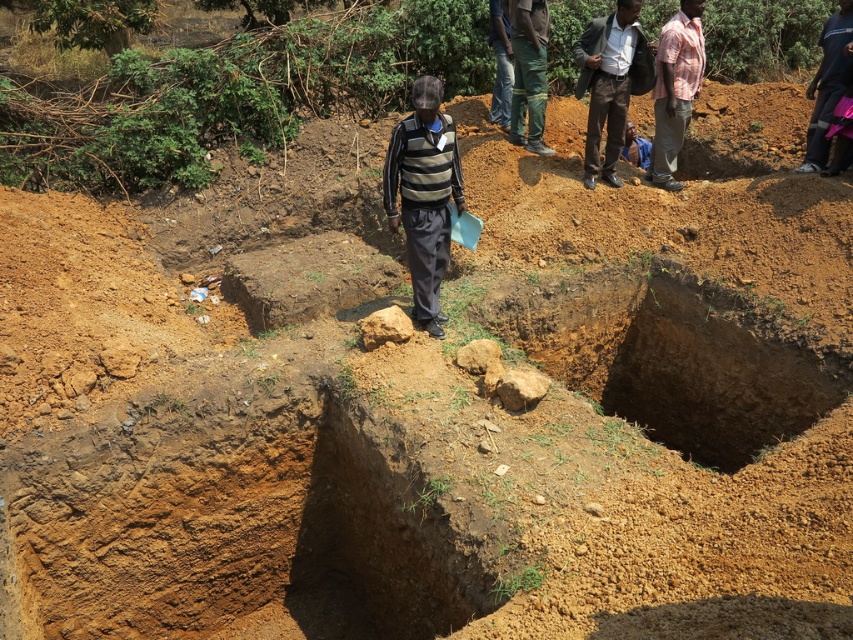
Question: Which object appears farthest from the camera in this image?

Choices:
 (A) green camouflage pants at center
 (B) brown dirt hole at center

Answer: (A)

Question: Does brown dirt hole at center appear on the right side of striped sweater at center?

Choices:
 (A) yes
 (B) no

Answer: (A)

Question: Is dark brown leather pants at center positioned behind blue denim shirt at center?

Choices:
 (A) yes
 (B) no

Answer: (B)

Question: Which point is closer to the camera?

Choices:
 (A) plaid cotton shirt at upper right
 (B) blue denim shirt at center

Answer: (A)

Question: Among these objects, which one is farthest from the camera?

Choices:
 (A) striped sweater at center
 (B) green camouflage pants at center
 (C) blue denim shirt at center

Answer: (C)

Question: Is brown dirt hole at center below blue denim shirt at center?

Choices:
 (A) yes
 (B) no

Answer: (A)